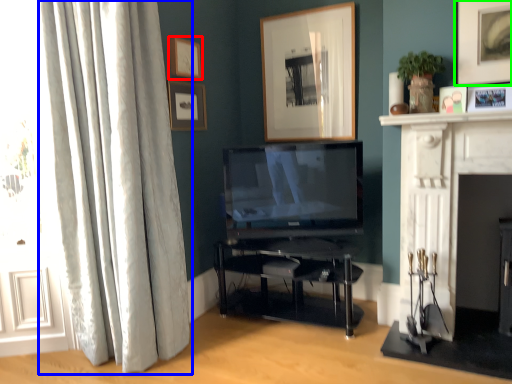
Question: Which object is the closest to the picture frame (highlighted by a red box)? Choose among these: curtain (highlighted by a blue box) or picture frame (highlighted by a green box).

Choices:
 (A) curtain
 (B) picture frame

Answer: (A)